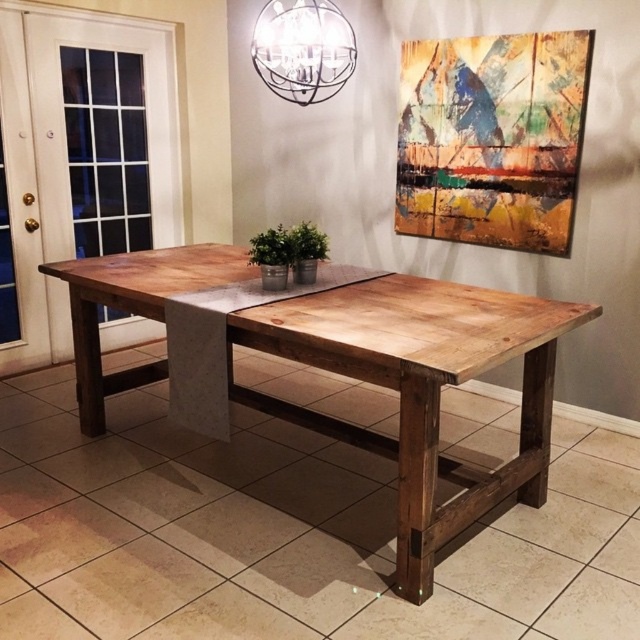
Is wooden table at center to the left of metallic sphere at upper center from the viewer's perspective?

No, wooden table at center is not to the left of metallic sphere at upper center.

Does wooden table at center appear on the right side of metallic sphere at upper center?

Correct, you'll find wooden table at center to the right of metallic sphere at upper center.

Between point (445, 352) and point (285, 8), which one is positioned in front?

Positioned in front is point (445, 352).

Find the location of a particular element. Image resolution: width=640 pixels, height=640 pixels. wooden table at center is located at coordinates (419, 387).